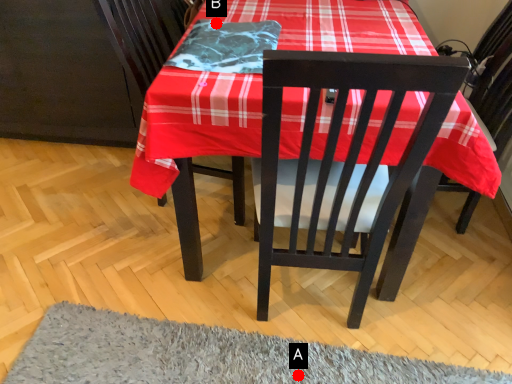
Question: Two points are circled on the image, labeled by A and B beside each circle. Among these points, which one is farthest from the camera?

Choices:
 (A) A is further
 (B) B is further

Answer: (B)